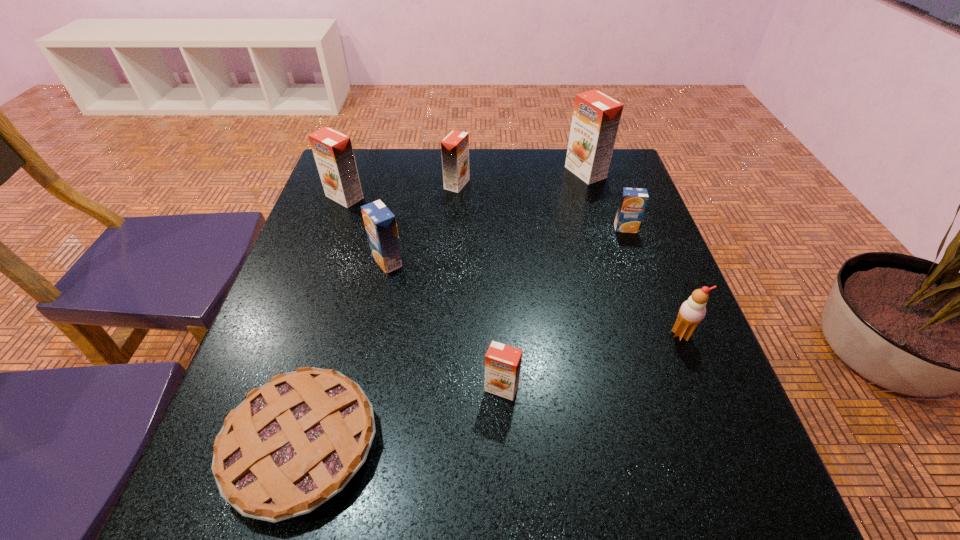
You are a GUI agent. You are given a task and a screenshot of the screen. Output one action in this format:
    pyautogui.click(x=<x>, y=<y>)
    Task: Click on the orange orange juice that is the second nearest to the third biggest orange orange juice
    Image resolution: width=960 pixels, height=540 pixels.
    Given the screenshot: What is the action you would take?
    pyautogui.click(x=596, y=116)

The image size is (960, 540). I want to click on blank area in the image that satisfies the following two spatial constraints: 1. on the back side of the shortest object; 2. on the right side of the fourth farthest orange juice, so click(364, 228).

Image resolution: width=960 pixels, height=540 pixels. In order to click on blank area in the image that satisfies the following two spatial constraints: 1. on the back side of the biggest orange orange juice; 2. on the right side of the third biggest orange orange juice in this screenshot , I will do `click(458, 172)`.